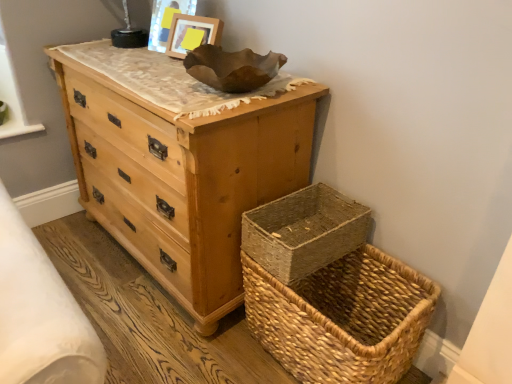
Image resolution: width=512 pixels, height=384 pixels. What do you see at coordinates (342, 318) in the screenshot? I see `natural woven picnic basket at lower right` at bounding box center [342, 318].

Locate an element on the screen. The width and height of the screenshot is (512, 384). natural wood chest of drawers at upper left is located at coordinates (183, 179).

Is natural wood chest of drawers at upper left not inside woven natural basket at lower right?

Absolutely, natural wood chest of drawers at upper left is external to woven natural basket at lower right.

Locate an element on the screen. This screenshot has height=384, width=512. the chest of drawers located above the woven natural basket at lower right (from the image's perspective) is located at coordinates (183, 179).

Considering the sizes of objects natural wood chest of drawers at upper left and woven natural basket at lower right in the image provided, who is smaller, natural wood chest of drawers at upper left or woven natural basket at lower right?

Smaller between the two is woven natural basket at lower right.

Considering the sizes of objects natural woven picnic basket at lower right and natural wood chest of drawers at upper left in the image provided, who is bigger, natural woven picnic basket at lower right or natural wood chest of drawers at upper left?

Bigger between the two is natural wood chest of drawers at upper left.

From a real-world perspective, which is physically above, natural woven picnic basket at lower right or natural wood chest of drawers at upper left?

natural wood chest of drawers at upper left is physically above.

Does point (279, 321) lie behind point (219, 133)?

Yes, point (279, 321) is behind point (219, 133).

How different are the orientations of natural woven picnic basket at lower right and natural wood chest of drawers at upper left in degrees?

There is a 0.408-degree angle between the facing directions of natural woven picnic basket at lower right and natural wood chest of drawers at upper left.

From a real-world perspective, between woven natural basket at lower right and natural wood chest of drawers at upper left, who is vertically lower?

natural wood chest of drawers at upper left.

Can you confirm if woven natural basket at lower right is shorter than natural wood chest of drawers at upper left?

Yes.

Is the surface of woven natural basket at lower right in direct contact with natural wood chest of drawers at upper left?

There is a gap between woven natural basket at lower right and natural wood chest of drawers at upper left.

In the scene shown: Is the depth of woven natural basket at lower right less than that of natural wood chest of drawers at upper left?

No, it is behind natural wood chest of drawers at upper left.

Locate an element on the screen. The image size is (512, 384). chest of drawers in front of the wooden frame at upper center is located at coordinates (183, 179).

Are wooden frame at upper center and natural wood chest of drawers at upper left far apart?

No.

Between wooden frame at upper center and natural wood chest of drawers at upper left, which one has smaller size?

Smaller between the two is wooden frame at upper center.

Is point (216, 29) less distant than point (279, 146)?

No, it is behind (279, 146).

Is woven natural basket at lower right facing away from wooden frame at upper center?

No, woven natural basket at lower right is not facing away from wooden frame at upper center.

Looking at this image, from a real-world perspective, which is physically above, woven natural basket at lower right or wooden frame at upper center?

wooden frame at upper center is physically above.

Is point (316, 214) less distant than point (181, 38)?

Yes, it is in front of point (181, 38).

You are a GUI agent. You are given a task and a screenshot of the screen. Output one action in this format:
    pyautogui.click(x=<x>, y=<y>)
    Task: Click on the picture frame behind the woven natural basket at lower right
    This screenshot has width=512, height=384.
    Given the screenshot: What is the action you would take?
    pyautogui.click(x=192, y=34)

Is wooden frame at upper center next to natural woven picnic basket at lower right?

There is a gap between wooden frame at upper center and natural woven picnic basket at lower right.

From the image's perspective, is wooden frame at upper center on top of natural woven picnic basket at lower right?

Yes, from the image's perspective, wooden frame at upper center is on top of natural woven picnic basket at lower right.

Find the location of `picnic basket beneath the wooden frame at upper center (from a real-world perspective)`. picnic basket beneath the wooden frame at upper center (from a real-world perspective) is located at coordinates (342, 318).

Is the surface of natural wood chest of drawers at upper left in direct contact with wooden frame at upper center?

No, natural wood chest of drawers at upper left is not next to wooden frame at upper center.

Is point (268, 197) behind point (185, 44)?

No, it is in front of (185, 44).

Considering the positions of objects natural wood chest of drawers at upper left and wooden frame at upper center in the image provided, who is more to the right, natural wood chest of drawers at upper left or wooden frame at upper center?

wooden frame at upper center is more to the right.

Identify the location of basket container that is on the right side of natural wood chest of drawers at upper left. (304, 231).

This screenshot has width=512, height=384. I want to click on the chest of drawers that appears above the natural woven picnic basket at lower right (from a real-world perspective), so click(x=183, y=179).

Based on their spatial positions, is natural wood chest of drawers at upper left or woven natural basket at lower right closer to wooden frame at upper center?

natural wood chest of drawers at upper left.

From the image, which object appears to be nearer to natural woven picnic basket at lower right, woven natural basket at lower right or natural wood chest of drawers at upper left?

The object closer to natural woven picnic basket at lower right is woven natural basket at lower right.

When comparing their distances from natural wood chest of drawers at upper left, does natural woven picnic basket at lower right or wooden frame at upper center seem further?

The object further to natural wood chest of drawers at upper left is wooden frame at upper center.

Based on their spatial positions, is natural woven picnic basket at lower right or natural wood chest of drawers at upper left closer to woven natural basket at lower right?

The object closer to woven natural basket at lower right is natural woven picnic basket at lower right.

Based on their spatial positions, is natural wood chest of drawers at upper left or wooden frame at upper center closer to natural woven picnic basket at lower right?

natural wood chest of drawers at upper left.

Which object lies nearer to the anchor point natural wood chest of drawers at upper left, wooden frame at upper center or natural woven picnic basket at lower right?

natural woven picnic basket at lower right is positioned closer to the anchor natural wood chest of drawers at upper left.

Consider the image. Considering their positions, is wooden frame at upper center positioned further to natural woven picnic basket at lower right than woven natural basket at lower right?

wooden frame at upper center is further to natural woven picnic basket at lower right.

From the image, which object appears to be farther from woven natural basket at lower right, natural wood chest of drawers at upper left or natural woven picnic basket at lower right?

Based on the image, natural wood chest of drawers at upper left appears to be further to woven natural basket at lower right.

Identify the location of basket container between wooden frame at upper center and natural woven picnic basket at lower right in the up-down direction. Image resolution: width=512 pixels, height=384 pixels. click(304, 231).

Where is `chest of drawers between wooden frame at upper center and natural woven picnic basket at lower right from top to bottom`? This screenshot has height=384, width=512. chest of drawers between wooden frame at upper center and natural woven picnic basket at lower right from top to bottom is located at coordinates (183, 179).

Image resolution: width=512 pixels, height=384 pixels. Identify the location of basket container situated between natural wood chest of drawers at upper left and natural woven picnic basket at lower right from left to right. (304, 231).

Find the location of a particular element. the chest of drawers that lies between wooden frame at upper center and woven natural basket at lower right from top to bottom is located at coordinates (183, 179).